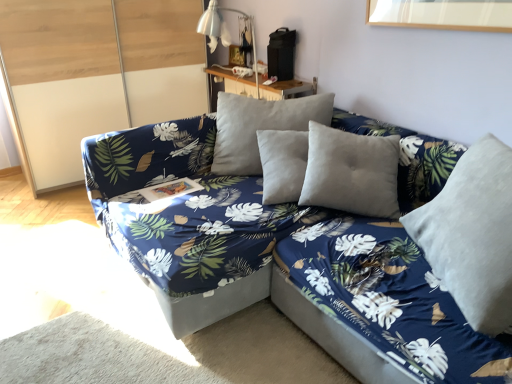
Question: In terms of width, does wooden table at upper center look wider or thinner when compared to velvet blue bed frame at center?

Choices:
 (A) thin
 (B) wide

Answer: (A)

Question: From the image's perspective, relative to velvet blue bed frame at center, is wooden table at upper center above or below?

Choices:
 (A) below
 (B) above

Answer: (B)

Question: Based on their relative distances, which object is farther from the blue fabric couch at center?

Choices:
 (A) metallic silver table lamp at upper center
 (B) velvet gray pillow at right
 (C) velvet blue bed frame at center
 (D) wooden table at upper center
 (E) transparent glass door at left

Answer: (E)

Question: Estimate the real-world distances between objects in this image. Which object is closer to the blue fabric couch at center?

Choices:
 (A) metallic silver table lamp at upper center
 (B) velvet blue bed frame at center
 (C) wooden table at upper center
 (D) transparent glass door at left
 (E) velvet gray pillow at right

Answer: (B)